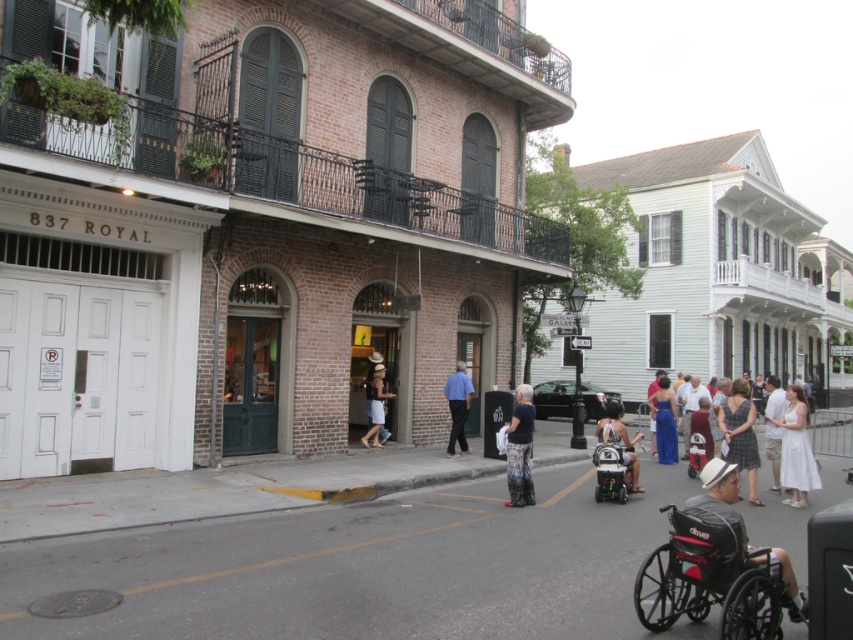
Who is higher up, dark gray dress at center or blue shirt at center?

blue shirt at center is higher up.

Between point (752, 436) and point (462, 365), which one is positioned in front?

Point (752, 436) is more forward.

Who is more forward, (727,433) or (450,404)?

Point (727,433) is more forward.

You are a GUI agent. You are given a task and a screenshot of the screen. Output one action in this format:
    pyautogui.click(x=<x>, y=<y>)
    Task: Click on the dark gray dress at center
    The width and height of the screenshot is (853, 640).
    Given the screenshot: What is the action you would take?
    pyautogui.click(x=740, y=433)

Looking at this image, can you confirm if brick building at center is positioned to the left of black plastic wheelchair at center?

Indeed, brick building at center is positioned on the left side of black plastic wheelchair at center.

Can you confirm if brick building at center is positioned above black plastic wheelchair at center?

Indeed, brick building at center is positioned over black plastic wheelchair at center.

Who is more distant from viewer, (206, 188) or (625, 456)?

The point (206, 188) is more distant.

You are a GUI agent. You are given a task and a screenshot of the screen. Output one action in this format:
    pyautogui.click(x=<x>, y=<y>)
    Task: Click on the brick building at center
    The width and height of the screenshot is (853, 640).
    Given the screenshot: What is the action you would take?
    pyautogui.click(x=264, y=225)

Does gray concrete sidewalk at center have a lesser height compared to blue satin dress at lower right?

Indeed, gray concrete sidewalk at center has a lesser height compared to blue satin dress at lower right.

Does point (468, 531) come behind point (659, 392)?

No, it is in front of (659, 392).

Does point (453, 561) lie behind point (666, 408)?

No, (453, 561) is closer to viewer.

Image resolution: width=853 pixels, height=640 pixels. I want to click on gray concrete sidewalk at center, so click(364, 566).